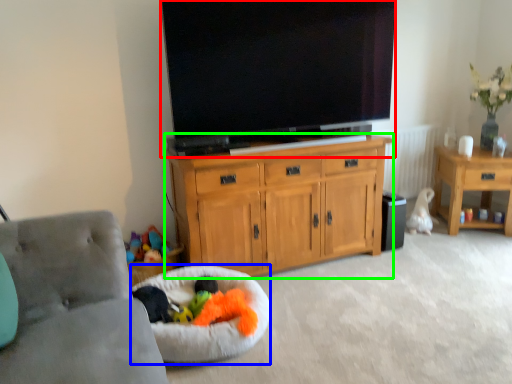
Question: Based on their relative distances, which object is nearer to television (highlighted by a red box)? Choose from dog bed (highlighted by a blue box) and cabinetry (highlighted by a green box).

Choices:
 (A) dog bed
 (B) cabinetry

Answer: (B)